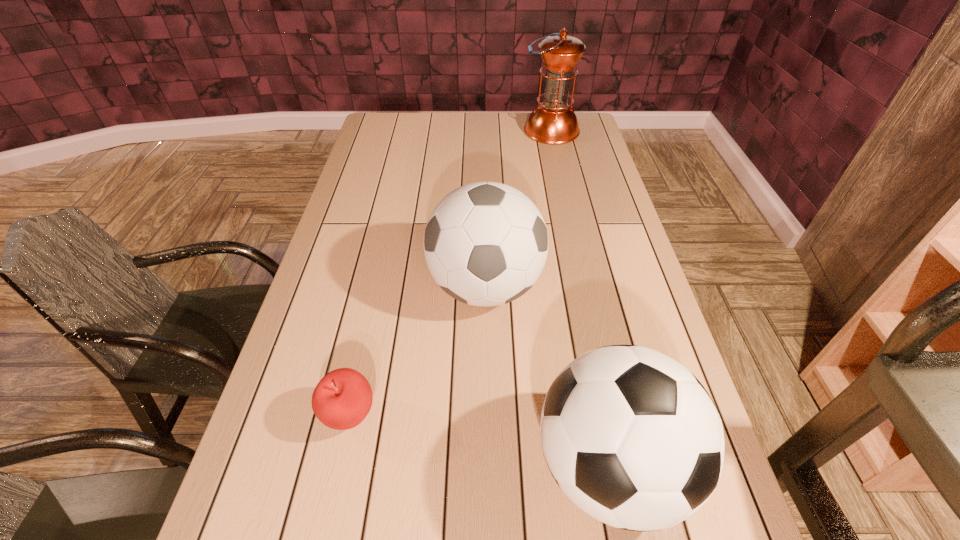
This screenshot has height=540, width=960. Find the location of `object present at the right edge`. object present at the right edge is located at coordinates (553, 122).

The image size is (960, 540). What are the coordinates of `object that is at the far right corner` in the screenshot? It's located at (553, 122).

Where is `vacant space at the far edge`? This screenshot has height=540, width=960. vacant space at the far edge is located at coordinates (527, 113).

In order to click on vacant space at the left edge of the desktop in this screenshot , I will do `click(392, 148)`.

I want to click on free space at the right edge of the desktop, so click(620, 284).

You are a GUI agent. You are given a task and a screenshot of the screen. Output one action in this format:
    pyautogui.click(x=<x>, y=<y>)
    Task: Click on the unoccupied area between the shortest object and the second farthest object
    This screenshot has width=960, height=540.
    Given the screenshot: What is the action you would take?
    pyautogui.click(x=418, y=350)

Identify which object is the third nearest to the third nearest object. Please provide its 2D coordinates. Your answer should be formatted as a tuple, i.e. [(x, y)], where the tuple contains the x and y coordinates of a point satisfying the conditions above.

[(553, 122)]

Select which object is the third closest to the nearer soccer ball. Please provide its 2D coordinates. Your answer should be formatted as a tuple, i.e. [(x, y)], where the tuple contains the x and y coordinates of a point satisfying the conditions above.

[(553, 122)]

Locate an element on the screen. free location that satisfies the following two spatial constraints: 1. on the back side of the farthest object; 2. on the right side of the second farthest object is located at coordinates (484, 131).